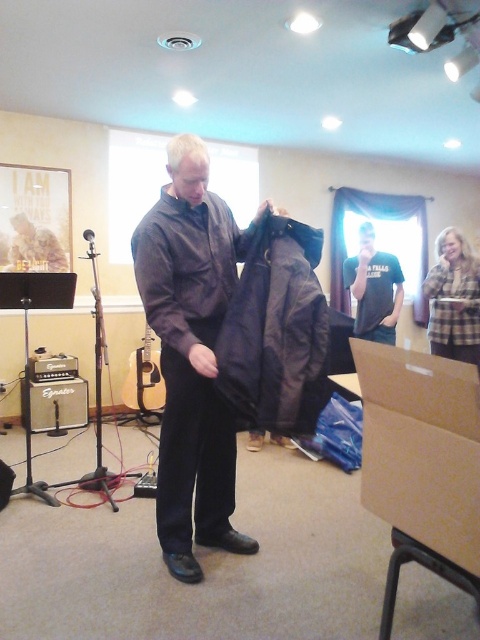
Based on the scene description, where is the leather jacket at center located in terms of its 2D coordinates?

The leather jacket at center is located at the 2D coordinates point (188, 268).

You are organizing a clothing display and need to place the brown cardboard box at lower right and the dark matte jacket at center. According to the scene, which object is closer to the viewer?

The brown cardboard box at lower right is closer to the viewer because it is in front of the dark matte jacket at center.